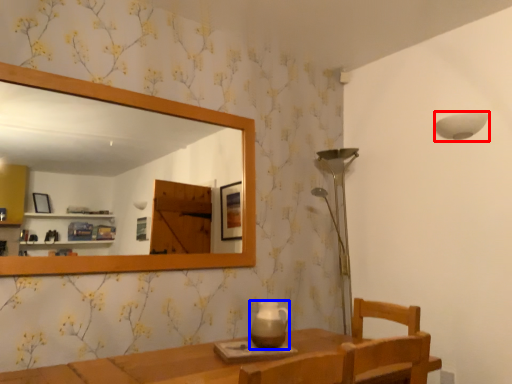
Question: Which of the following is the closest to the observer, lamp (highlighted by a red box) or tea pot (highlighted by a blue box)?

Choices:
 (A) lamp
 (B) tea pot

Answer: (B)